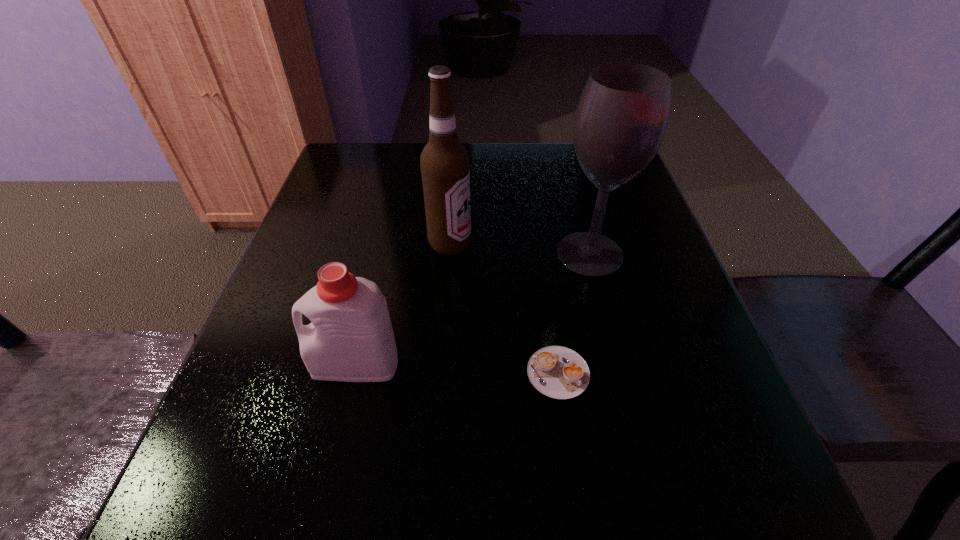
Image resolution: width=960 pixels, height=540 pixels. I want to click on vacant space positioned on the left of the shortest object, so click(306, 373).

Find the location of a particular element. object that is at the left edge is located at coordinates (351, 339).

Where is `object that is at the right edge`? This screenshot has width=960, height=540. object that is at the right edge is located at coordinates point(621,118).

Identify the location of blank space at the far edge of the desktop. Image resolution: width=960 pixels, height=540 pixels. (517, 161).

Where is `vacant space at the near edge`? The image size is (960, 540). vacant space at the near edge is located at coordinates (429, 483).

Identify the location of vacant space at the left edge of the desktop. (303, 262).

Locate an element on the screen. vacant area at the right edge of the desktop is located at coordinates (648, 202).

Image resolution: width=960 pixels, height=540 pixels. I want to click on free location at the far left corner, so click(353, 150).

At what (x,y) coordinates should I click in order to perform the action: click on empty space between the right alcohol and the left alcohol. Please return your answer as a coordinate pair (x, y). Image resolution: width=960 pixels, height=540 pixels. Looking at the image, I should click on (520, 249).

What are the coordinates of `unoccupied area between the left alcohol and the right alcohol` in the screenshot? It's located at (520, 249).